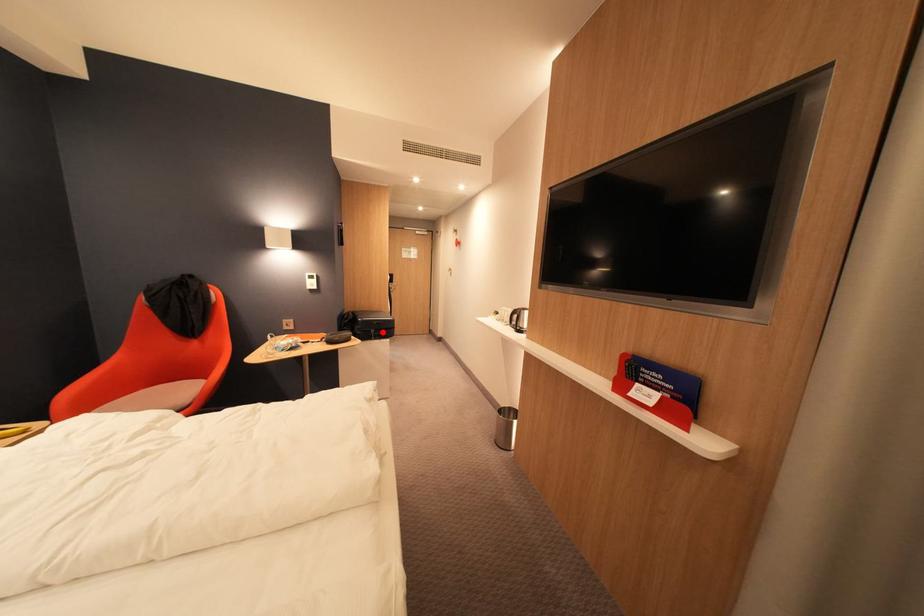
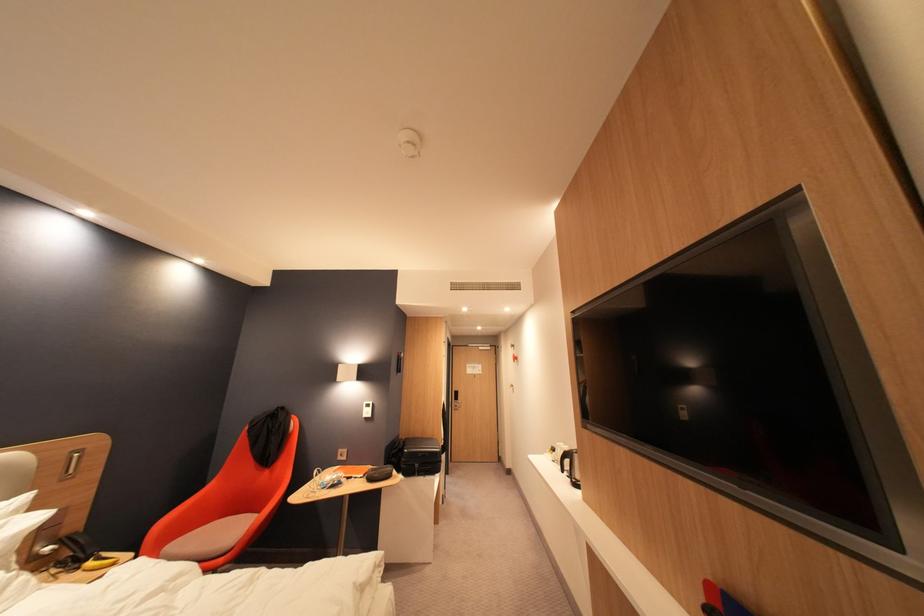
The point at the highlighted location is marked in the first image. Where is the corresponding point in the second image?

(427, 467)